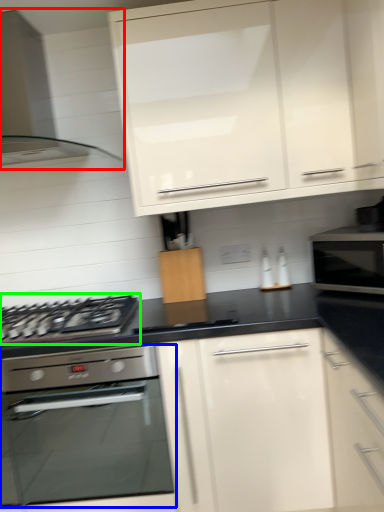
Question: Considering the real-world distances, which object is farthest from home appliance (highlighted by a red box)? kitchen appliance (highlighted by a blue box) or gas stove (highlighted by a green box)?

Choices:
 (A) kitchen appliance
 (B) gas stove

Answer: (A)